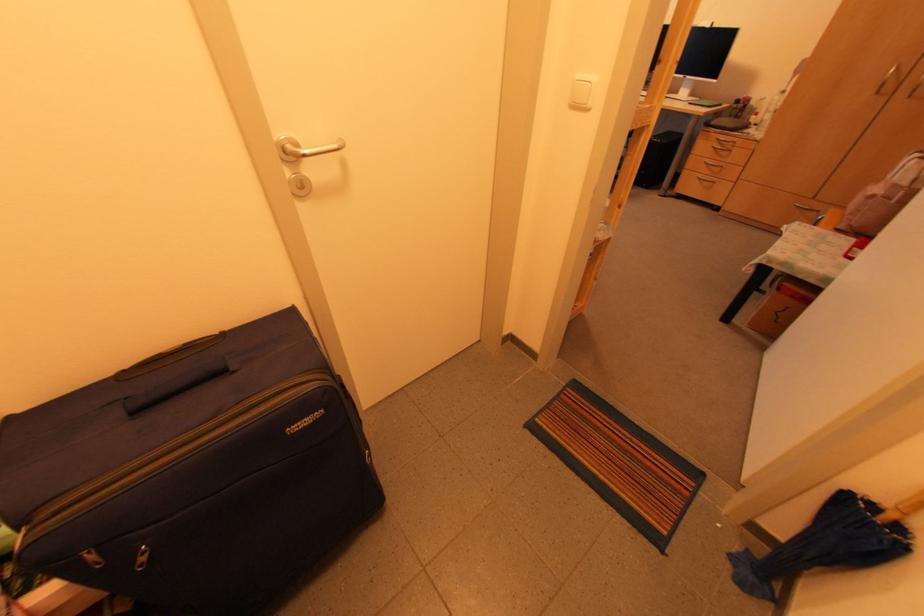
Find where to lift the umbrella handle. Please return your answer as a coordinate pair (x, y).

(903, 508)